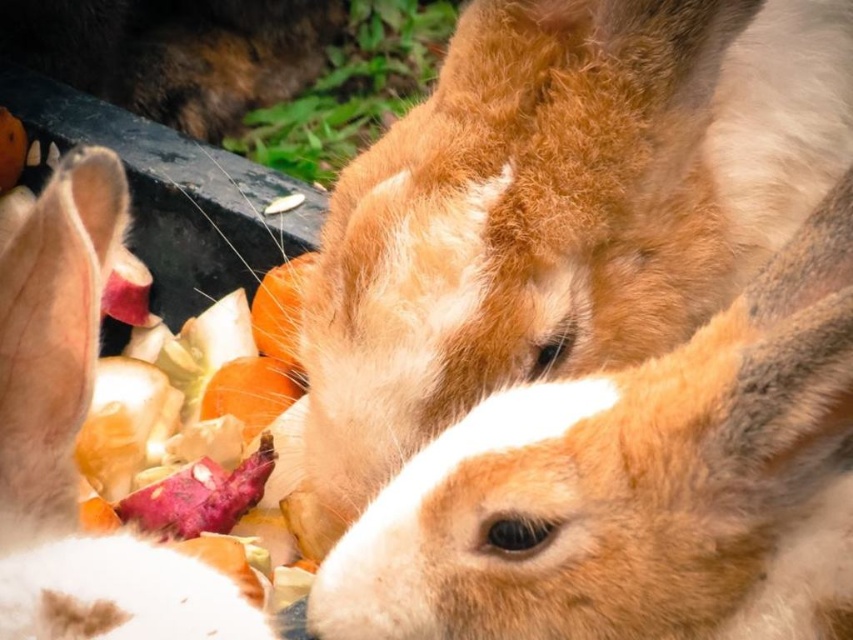
Based on the photo, measure the distance from fuzzy brown rabbit at center to white fur rabbit at left.

10.43 inches

Who is shorter, fuzzy brown rabbit at center or white fur rabbit at left?

white fur rabbit at left is shorter.

Does point (781, 285) come closer to viewer compared to point (154, 593)?

No.

This screenshot has height=640, width=853. Identify the location of fuzzy brown rabbit at center. (635, 488).